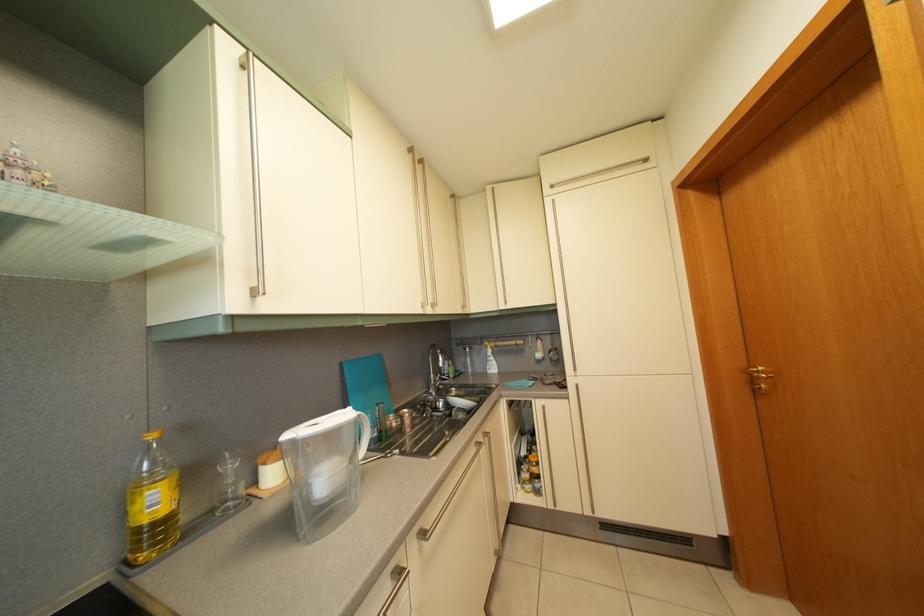
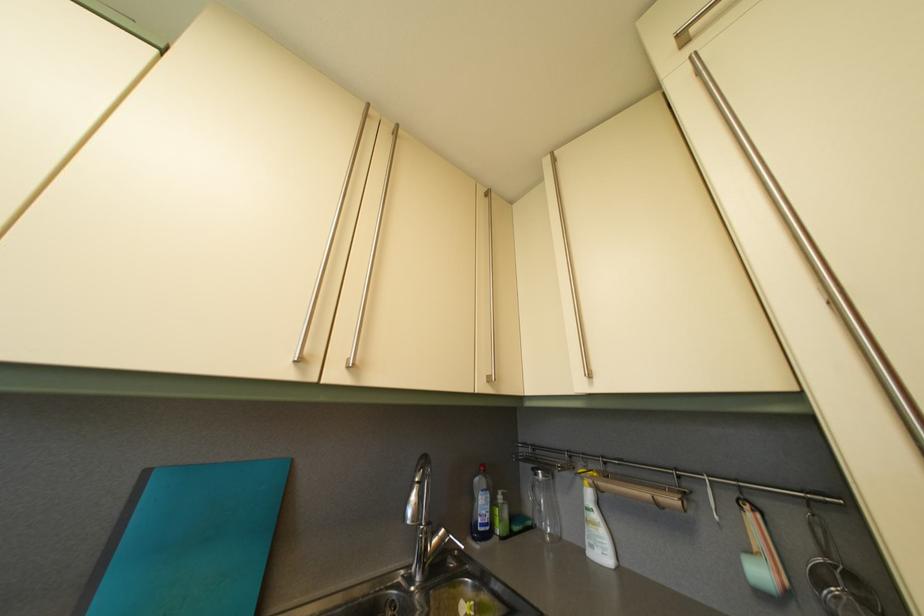
The point at [349,371] is marked in the first image. Where is the corresponding point in the second image?

(154, 480)